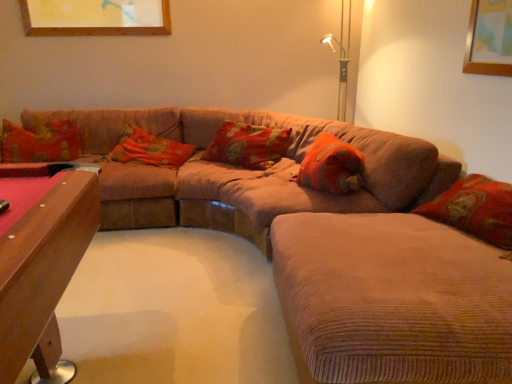
Question: Would you say corduroy textured pillow at center, the 3th pillow when ordered from left to right, contains corduroy couch at center?

Choices:
 (A) yes
 (B) no

Answer: (B)

Question: Is corduroy textured pillow at center, which appears as the 2th pillow when viewed from the right, beside corduroy couch at center?

Choices:
 (A) no
 (B) yes

Answer: (A)

Question: From a real-world perspective, is corduroy textured pillow at center, the 3th pillow when ordered from left to right, below corduroy couch at center?

Choices:
 (A) yes
 (B) no

Answer: (B)

Question: Can you confirm if corduroy textured pillow at center, the 3th pillow when ordered from left to right, is shorter than corduroy couch at center?

Choices:
 (A) no
 (B) yes

Answer: (B)

Question: Is corduroy textured pillow at center, which appears as the 2th pillow when viewed from the right, positioned beyond the bounds of corduroy couch at center?

Choices:
 (A) yes
 (B) no

Answer: (B)

Question: Is corduroy couch at lower right spatially inside corduroy textured pillow at center, the 3th pillow when ordered from left to right, or outside of it?

Choices:
 (A) inside
 (B) outside

Answer: (B)

Question: Relative to corduroy textured pillow at center, which appears as the 2th pillow when viewed from the right, is corduroy couch at lower right in front or behind?

Choices:
 (A) front
 (B) behind

Answer: (A)

Question: Considering the positions of corduroy couch at lower right and corduroy textured pillow at center, which appears as the 2th pillow when viewed from the right, in the image, is corduroy couch at lower right wider or thinner than corduroy textured pillow at center, which appears as the 2th pillow when viewed from the right,?

Choices:
 (A) thin
 (B) wide

Answer: (B)

Question: From the image's perspective, is corduroy couch at lower right positioned above or below corduroy textured pillow at center, which appears as the 2th pillow when viewed from the right?

Choices:
 (A) above
 (B) below

Answer: (B)

Question: In the image, is corduroy couch at center positioned in front of or behind corduroy couch at lower right?

Choices:
 (A) front
 (B) behind

Answer: (B)

Question: Is corduroy couch at center wider or thinner than corduroy couch at lower right?

Choices:
 (A) wide
 (B) thin

Answer: (A)

Question: Is corduroy couch at center spatially inside corduroy couch at lower right, or outside of it?

Choices:
 (A) outside
 (B) inside

Answer: (A)

Question: Considering the positions of corduroy couch at center and corduroy couch at lower right in the image, is corduroy couch at center taller or shorter than corduroy couch at lower right?

Choices:
 (A) short
 (B) tall

Answer: (B)

Question: From a real-world perspective, relative to corduroy couch at lower right, is floral fabric pillow at center, arranged as the third pillow when viewed from the right, vertically above or below?

Choices:
 (A) below
 (B) above

Answer: (B)

Question: Considering the positions of floral fabric pillow at center, arranged as the third pillow when viewed from the right, and corduroy couch at lower right in the image, is floral fabric pillow at center, arranged as the third pillow when viewed from the right, taller or shorter than corduroy couch at lower right?

Choices:
 (A) short
 (B) tall

Answer: (A)